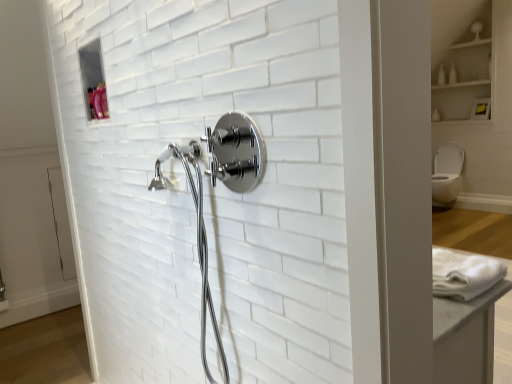
Question: Should I look upward or downward to see white glossy bottle at upper right?

Choices:
 (A) up
 (B) down

Answer: (A)

Question: From a real-world perspective, is white glossy bottle at upper right positioned over white glossy toilet bowl at right based on gravity?

Choices:
 (A) no
 (B) yes

Answer: (B)

Question: Is white glossy bottle at upper right facing towards white glossy toilet bowl at right?

Choices:
 (A) no
 (B) yes

Answer: (A)

Question: Is white glossy toilet bowl at right a part of white glossy bottle at upper right?

Choices:
 (A) yes
 (B) no

Answer: (B)

Question: Considering the relative sizes of white glossy bottle at upper right and white glossy toilet bowl at right in the image provided, is white glossy bottle at upper right taller than white glossy toilet bowl at right?

Choices:
 (A) no
 (B) yes

Answer: (A)

Question: Is white glossy bottle at upper right with white glossy toilet bowl at right?

Choices:
 (A) yes
 (B) no

Answer: (B)

Question: Can you confirm if white glossy bottle at upper right is shorter than white glossy toilet bowl at right?

Choices:
 (A) yes
 (B) no

Answer: (A)

Question: Would you say chrome/metallic showerhead at center is outside white glossy bottle at upper right?

Choices:
 (A) no
 (B) yes

Answer: (B)

Question: Considering the relative sizes of chrome/metallic showerhead at center and white glossy bottle at upper right in the image provided, is chrome/metallic showerhead at center shorter than white glossy bottle at upper right?

Choices:
 (A) no
 (B) yes

Answer: (A)

Question: Is chrome/metallic showerhead at center next to white glossy bottle at upper right?

Choices:
 (A) yes
 (B) no

Answer: (B)

Question: Is chrome/metallic showerhead at center oriented towards white glossy bottle at upper right?

Choices:
 (A) yes
 (B) no

Answer: (B)

Question: Is the depth of chrome/metallic showerhead at center less than that of white glossy bottle at upper right?

Choices:
 (A) yes
 (B) no

Answer: (A)

Question: Does chrome/metallic showerhead at center have a smaller size compared to white glossy bottle at upper right?

Choices:
 (A) no
 (B) yes

Answer: (A)

Question: Considering the relative positions of white glossy cabinet at upper right and chrome/metallic showerhead at center in the image provided, is white glossy cabinet at upper right to the right of chrome/metallic showerhead at center from the viewer's perspective?

Choices:
 (A) yes
 (B) no

Answer: (A)